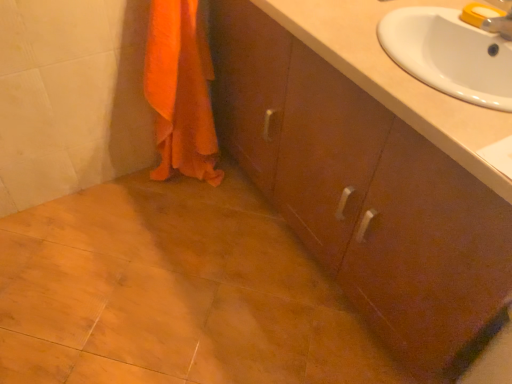
Where is `vacant space in front of orange fabric towel at lower left`? This screenshot has height=384, width=512. vacant space in front of orange fabric towel at lower left is located at coordinates (179, 220).